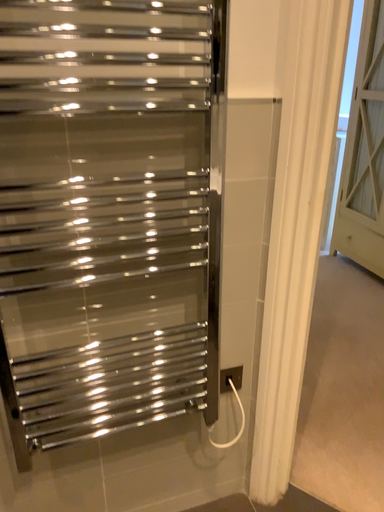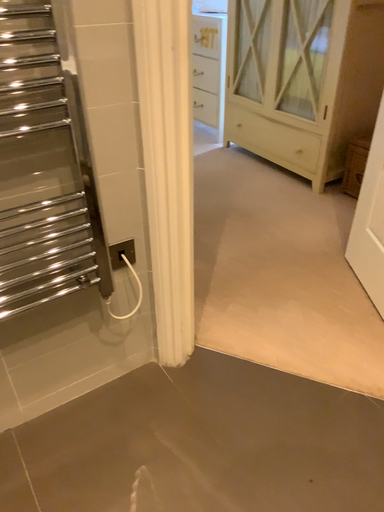
Question: How did the camera likely rotate when shooting the video?

Choices:
 (A) rotated left
 (B) rotated right

Answer: (B)